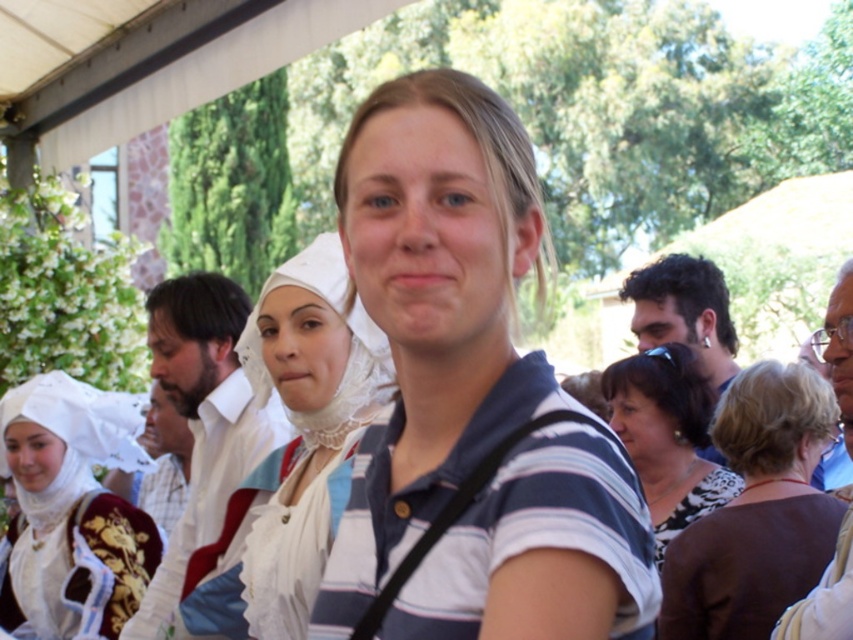
You are a photographer standing at the edge of the event area. You want to capture a photo that includes the white lace headdress at center. Based on the coordinates provided, where should you position your camera to ensure the headdress is centered in your shot?

To center the white lace headdress at center in your photo, position your camera so that it aligns with the coordinates point (294, 445).

From the picture: You are a photographer setting up for an event. You need to position a 16 inch wide camera tripod between the brown fabric at center and the blue striped shirt at center. Is there enough space to place the tripod without overlapping either object?

The brown fabric at center is 17.58 inches from the blue striped shirt at center. Since the tripod is 16 inches wide, there is enough space to place it between them without overlapping either object.

You are a photographer at the event and want to ensure both the brown fabric at center and the blue striped shirt at center are visible in your photo. Which object should you focus on to capture both without cropping?

The brown fabric at center has a lesser height compared to blue striped shirt at center, so focusing on the blue striped shirt at center would allow both objects to be visible as it is taller and can be positioned to include the shorter brown fabric at center in the frame.